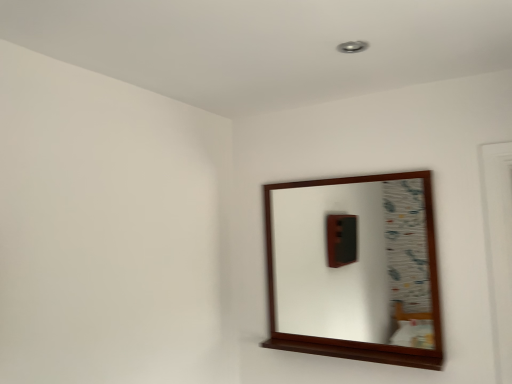
What do you see at coordinates (354, 263) in the screenshot? The image size is (512, 384). I see `dark wood mirror at upper center` at bounding box center [354, 263].

This screenshot has width=512, height=384. I want to click on dark wood mirror at upper center, so click(354, 263).

You are a GUI agent. You are given a task and a screenshot of the screen. Output one action in this format:
    pyautogui.click(x=<x>, y=<y>)
    Task: Click on the dark wood mirror at upper center
    
    Given the screenshot: What is the action you would take?
    pyautogui.click(x=354, y=263)